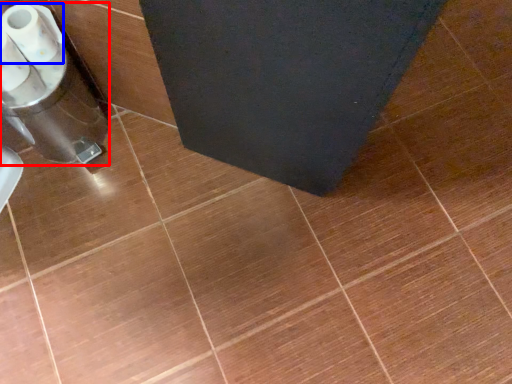
Question: Which point is closer to the camera, appliance (highlighted by a red box) or toilet paper (highlighted by a blue box)?

Choices:
 (A) appliance
 (B) toilet paper

Answer: (B)